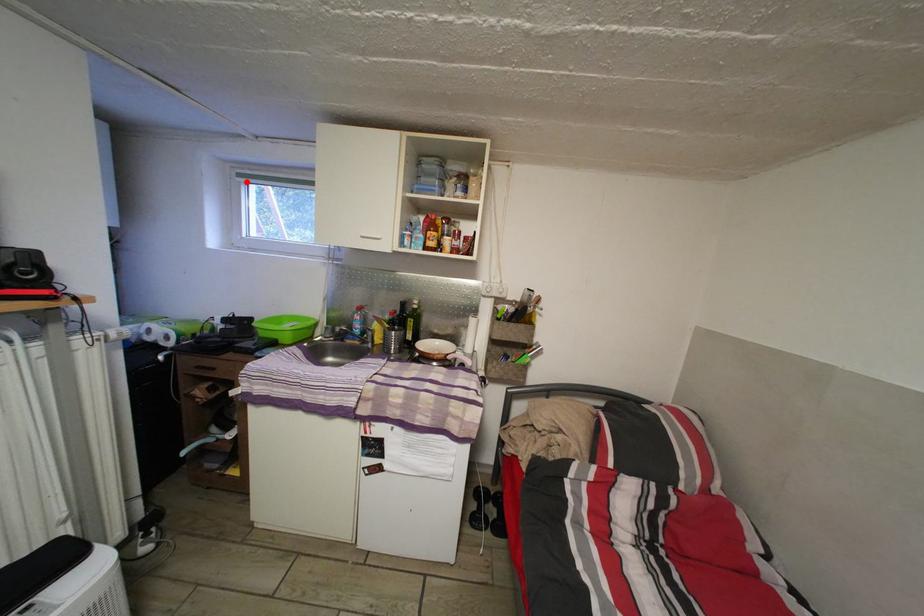
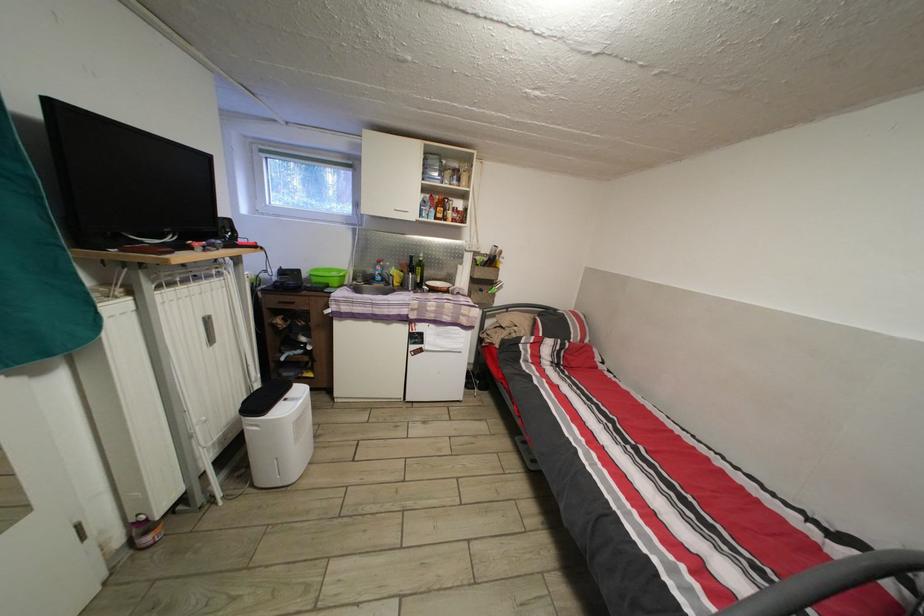
Question: I am providing you with two images of the same scene from different viewpoints. In image1, a red point is highlighted. Considering the same 3D point in image2, which of the following is correct?

Choices:
 (A) It is closer
 (B) It is farther

Answer: (B)